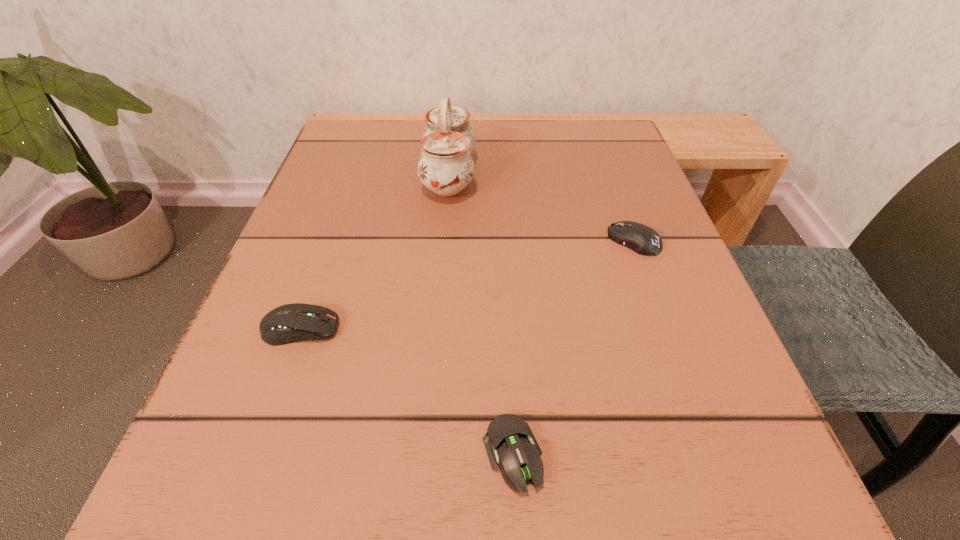
Find the location of a particular element. free space between the second tallest computer mouse and the farthest object is located at coordinates (541, 208).

I want to click on free space between the third nearest object and the tallest object, so click(x=541, y=208).

You are a GUI agent. You are given a task and a screenshot of the screen. Output one action in this format:
    pyautogui.click(x=<x>, y=<y>)
    Task: Click on the free spot between the second tallest object and the nearest computer mouse
    The width and height of the screenshot is (960, 540).
    Given the screenshot: What is the action you would take?
    pyautogui.click(x=406, y=392)

This screenshot has height=540, width=960. What are the coordinates of `free point between the leftmost object and the tallest object` in the screenshot? It's located at (374, 252).

Locate an element on the screen. free spot between the second object from left to right and the third farthest object is located at coordinates (374, 252).

In order to click on vacant area that lies between the second nearest object and the second tallest computer mouse in this screenshot , I will do `click(467, 285)`.

This screenshot has height=540, width=960. I want to click on empty location between the second computer mouse from right to left and the second shortest object, so click(573, 348).

The height and width of the screenshot is (540, 960). Find the location of `empty space that is in between the tallest computer mouse and the farthest computer mouse`. empty space that is in between the tallest computer mouse and the farthest computer mouse is located at coordinates (467, 285).

Identify the location of free spot between the second nearest computer mouse and the second tallest computer mouse. (467, 285).

Locate an element on the screen. This screenshot has height=540, width=960. object that ranks as the closest to the nearest object is located at coordinates (295, 322).